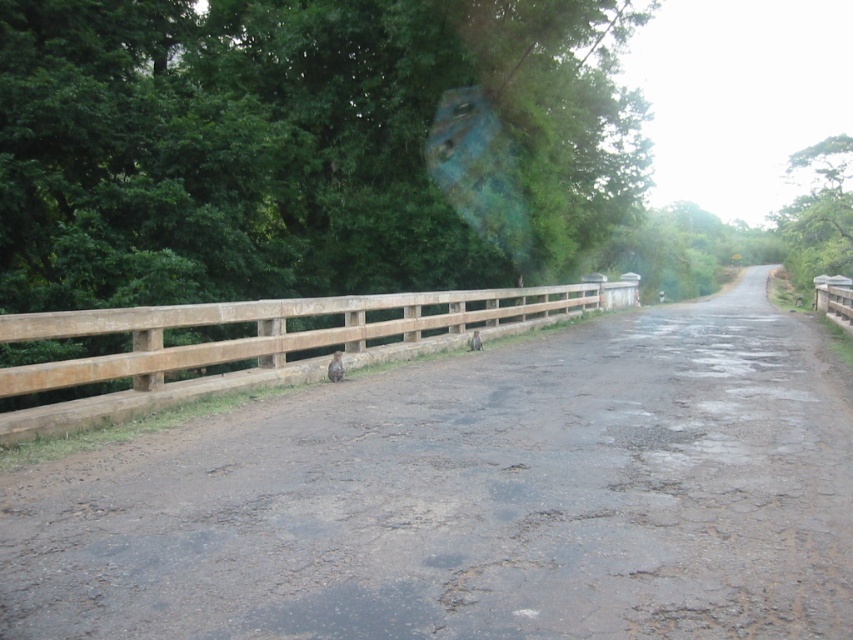
Does brown rough dirt track at center appear on the right side of brown wooden fence at center?

Correct, you'll find brown rough dirt track at center to the right of brown wooden fence at center.

Who is lower down, brown rough dirt track at center or brown wooden fence at center?

Positioned lower is brown rough dirt track at center.

In the scene shown: Measure the distance between point (753, 570) and camera.

Point (753, 570) is 4.60 meters from camera.

Locate an element on the screen. This screenshot has height=640, width=853. brown rough dirt track at center is located at coordinates (473, 497).